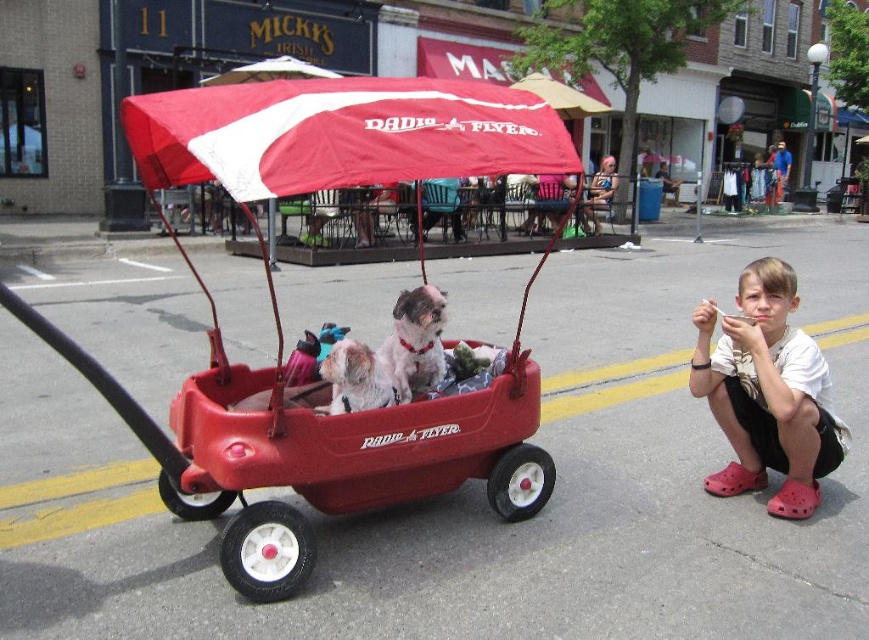
Based on the photo, you are a delivery robot with a package that needs to fit between the matte plastic wagon at center and the pink croc shoes at lower right. Based on their widths, can the package pass through the narrowest point between them?

The matte plastic wagon at center is wider than the pink croc shoes at lower right. The narrowest point between them would be near the pink croc shoes at lower right. Since the pink croc shoes at lower right are narrower, the package can pass through if it is narrower than their width.

You are a delivery robot that needs to place a package in the area shown. The package is the size of the pink croc shoes at lower right. Can you fit the package in the matte plastic wagon at center without removing any items?

The matte plastic wagon at center has a larger size compared to pink croc shoes at lower right, so yes, the package can fit inside the wagon.